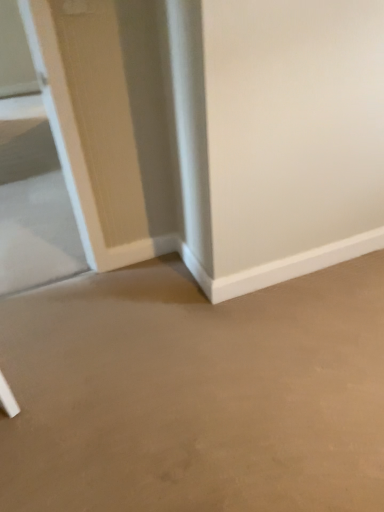
Question: From a real-world perspective, is clear glass door at left above or below beige matte concrete at center?

Choices:
 (A) below
 (B) above

Answer: (A)

Question: From the image's perspective, relative to beige matte concrete at center, is clear glass door at left above or below?

Choices:
 (A) above
 (B) below

Answer: (A)

Question: Is clear glass door at left wider or thinner than beige matte concrete at center?

Choices:
 (A) thin
 (B) wide

Answer: (B)

Question: Which is correct: beige matte concrete at center is inside clear glass door at left, or outside of it?

Choices:
 (A) outside
 (B) inside

Answer: (A)

Question: Does point (271, 374) appear closer or farther from the camera than point (69, 253)?

Choices:
 (A) closer
 (B) farther

Answer: (A)

Question: From a real-world perspective, is beige matte concrete at center positioned above or below clear glass door at left?

Choices:
 (A) above
 (B) below

Answer: (A)

Question: From the image's perspective, relative to clear glass door at left, is beige matte concrete at center above or below?

Choices:
 (A) below
 (B) above

Answer: (A)